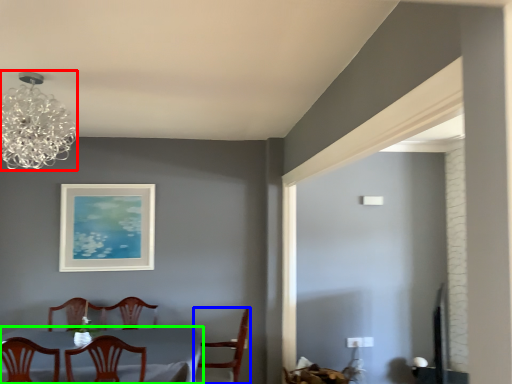
Question: Which is farther away from lamp (highlighted by a red box)? chair (highlighted by a blue box) or table (highlighted by a green box)?

Choices:
 (A) chair
 (B) table

Answer: (A)